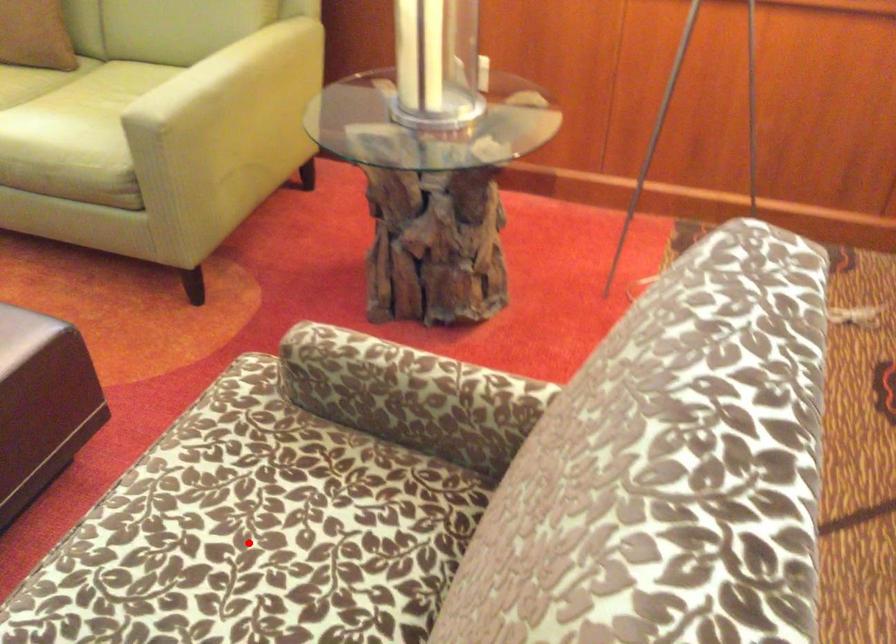
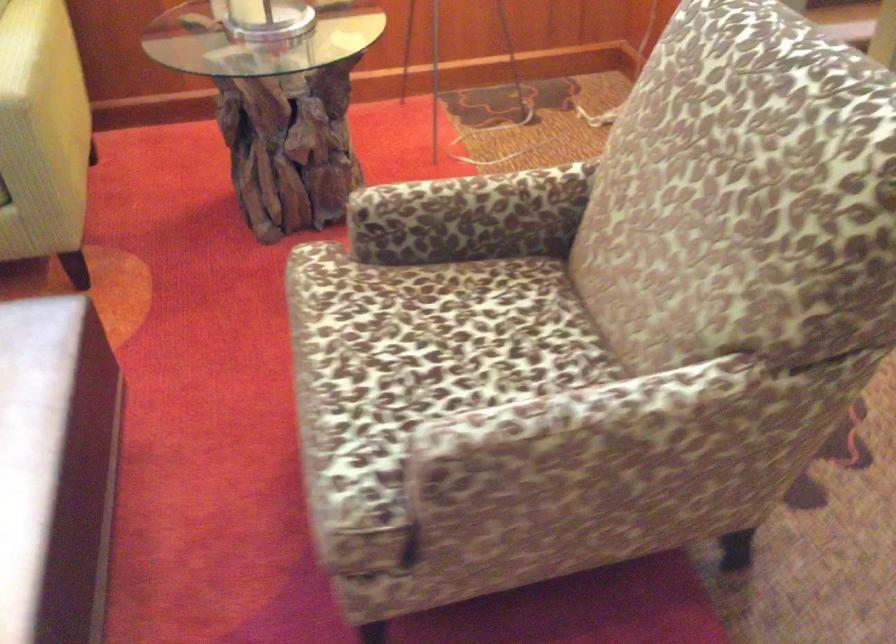
Question: A red point is marked in image1. In image2, is the corresponding 3D point closer to the camera or farther? Reply with the corresponding letter.

Choices:
 (A) The corresponding 3D point is closer.
 (B) The corresponding 3D point is farther.

Answer: (B)